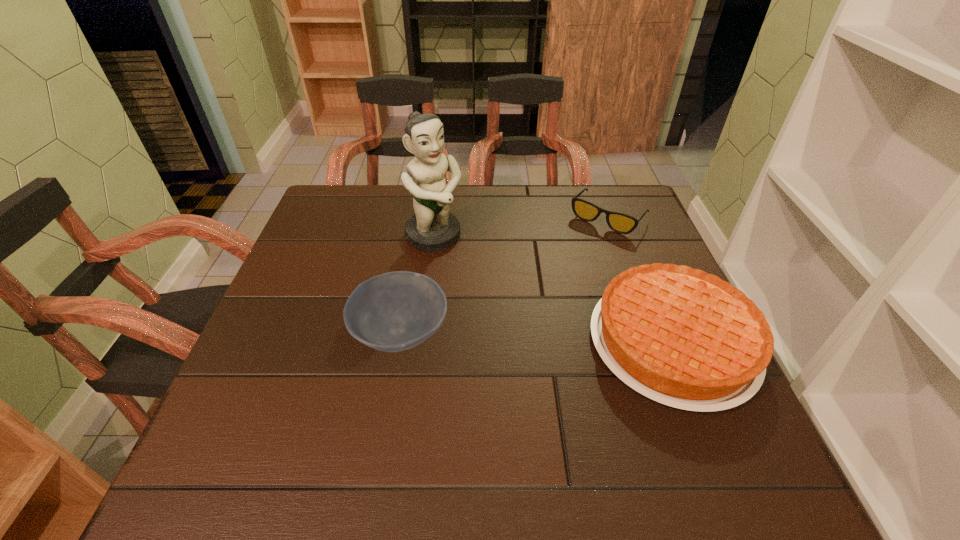
In order to click on free space on the desktop that is between the bowl and the pie and is positioned on the front-facing side of the shortest object in this screenshot , I will do `click(509, 337)`.

Identify the location of vacant space on the desktop that is between the bowl and the pie and is positioned on the front-facing side of the tallest object. (537, 338).